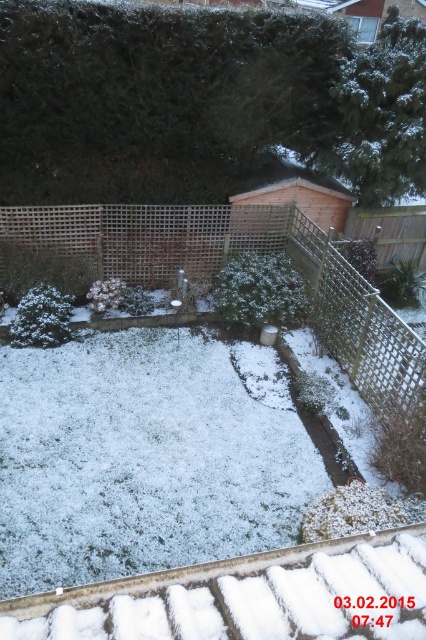
Between point (402, 392) and point (363, 300), which one is positioned behind?

The point (363, 300) is more distant.

Where is `wooden lattice fence at center`? wooden lattice fence at center is located at coordinates (222, 262).

Find the location of a particular element. wooden lattice fence at center is located at coordinates (222, 262).